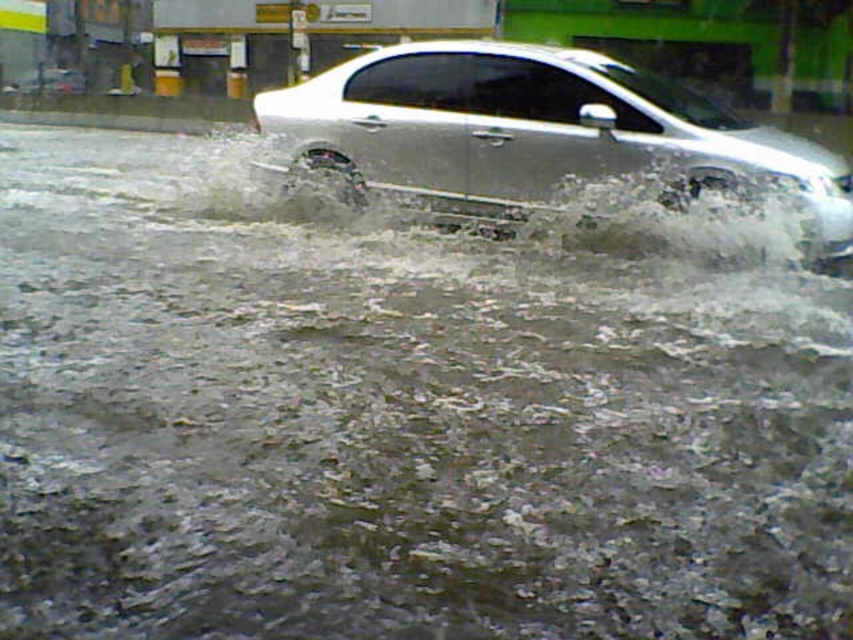
Question: Which point is farther from the camera taking this photo?

Choices:
 (A) (398, 92)
 (B) (67, 92)

Answer: (B)

Question: Is silver metallic car at center further to the viewer compared to satin silver sedan at center?

Choices:
 (A) yes
 (B) no

Answer: (B)

Question: Is silver metallic car at center closer to the viewer compared to satin silver sedan at center?

Choices:
 (A) yes
 (B) no

Answer: (A)

Question: Is silver metallic car at center thinner than satin silver sedan at center?

Choices:
 (A) yes
 (B) no

Answer: (B)

Question: Which point is closer to the camera?

Choices:
 (A) silver metallic car at center
 (B) satin silver sedan at center

Answer: (A)